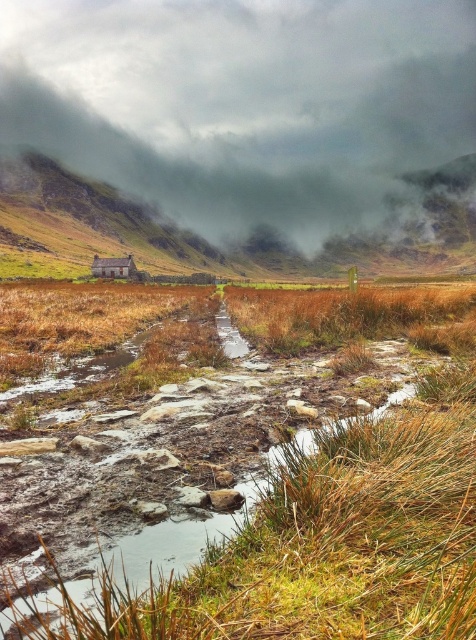
You are a hiker planning to traverse the muddy path in the foreground of the image. You notice the gray foggy cloud at upper center and the brown grassy hillside at center. Which of these two objects appears bigger in the image?

The gray foggy cloud at upper center appears bigger than the brown grassy hillside at center in the image.

You are a hiker lost in the misty landscape. You see the gray foggy cloud at upper center and the brown wooden hut at center. Which object is farther away from you?

The gray foggy cloud at upper center is 214.36 meters away from the brown wooden hut at center, so the gray foggy cloud at upper center is farther away from you than the brown wooden hut at center.

You are an explorer trying to navigate through the muddy path in the image. You need to determine the direction of the wind to avoid getting wet. Based on the position of the gray foggy cloud at upper center and the brown grassy hillside at center, which direction is the wind blowing?

The gray foggy cloud at upper center is above the brown grassy hillside at center, indicating that the wind is blowing from the direction of the hillside towards the cloud, so the wind is blowing upwards from the brown grassy hillside at center toward the gray foggy cloud at upper center.